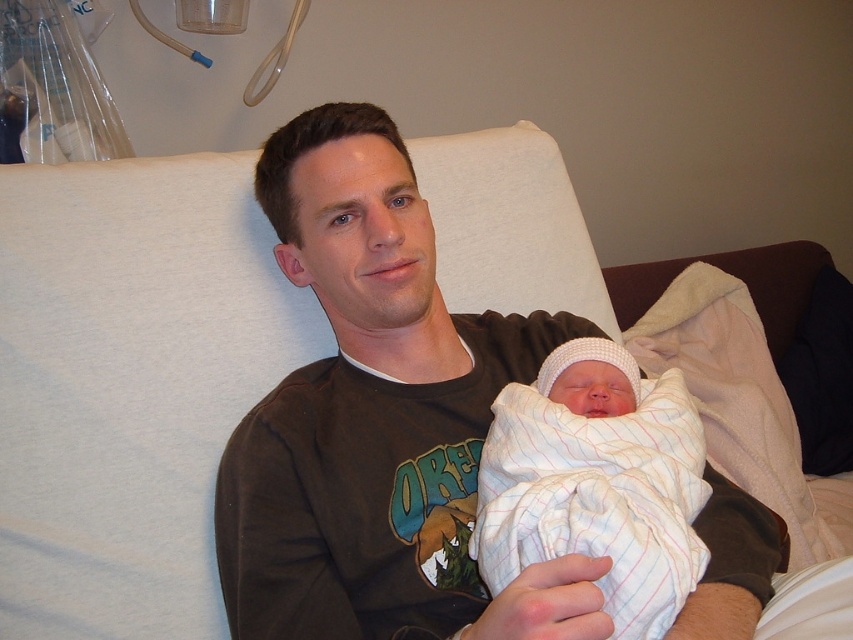
Does brown cotton shirt at center come behind white striped swaddle at center?

No, it is not.

Is brown cotton shirt at center below white striped swaddle at center?

Incorrect, brown cotton shirt at center is not positioned below white striped swaddle at center.

Is point (277, 408) closer to viewer compared to point (676, 518)?

That is False.

At what (x,y) coordinates should I click in order to perform the action: click on brown cotton shirt at center. Please return your answer as a coordinate pair (x, y). The height and width of the screenshot is (640, 853). Looking at the image, I should click on (376, 419).